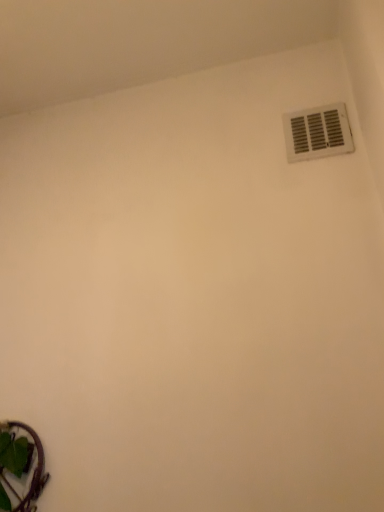
Find the location of a particular element. white plastic vent at upper right is located at coordinates (317, 133).

In order to face white plastic vent at upper right, should I rotate leftwards or rightwards?

To align with it, rotate right about 16.245°.

Describe the element at coordinates (317, 133) in the screenshot. I see `white plastic vent at upper right` at that location.

Find the location of a particular element. The image size is (384, 512). white plastic vent at upper right is located at coordinates (317, 133).